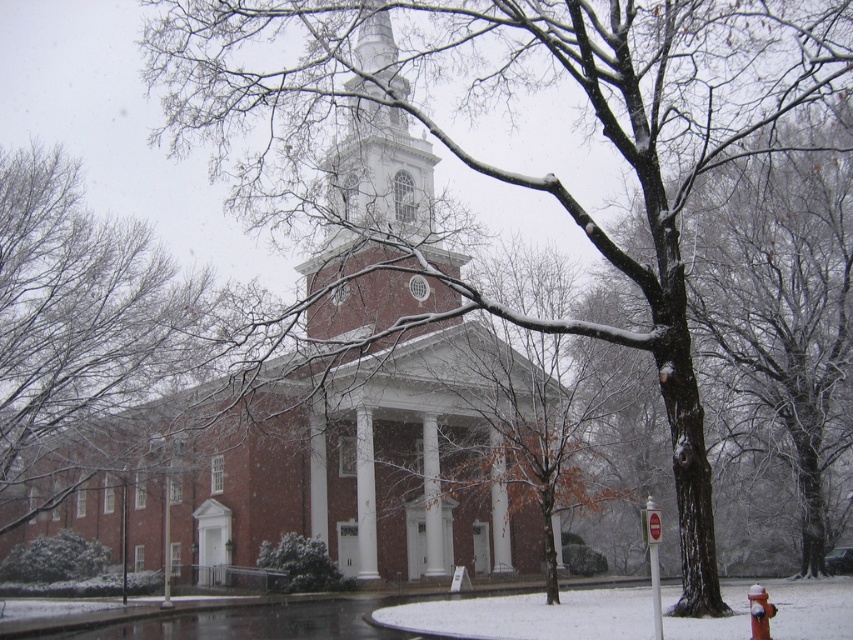
You are standing in front of the church and notice two points marked in the scene. Which point is closer to you, point (206, 564) or point (753, 627)?

Point (206, 564) is further to the viewer than point (753, 627), so point (753, 627) is closer to you.

You are a photographer planning to take a photo of the brick building at center and the white textured steeple at center. If you want to ensure both are fully visible in the frame, which one should you focus on to avoid cropping the top?

The brick building at center is much taller than the white textured steeple at center. Therefore, to avoid cropping the top, you should focus on the brick building at center to ensure its full height is captured in the frame.